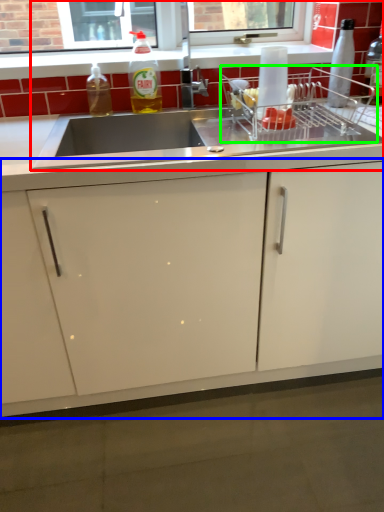
Question: Which is nearer to the sink (highlighted by a red box)? cabinetry (highlighted by a blue box) or appliance (highlighted by a green box).

Choices:
 (A) cabinetry
 (B) appliance

Answer: (B)